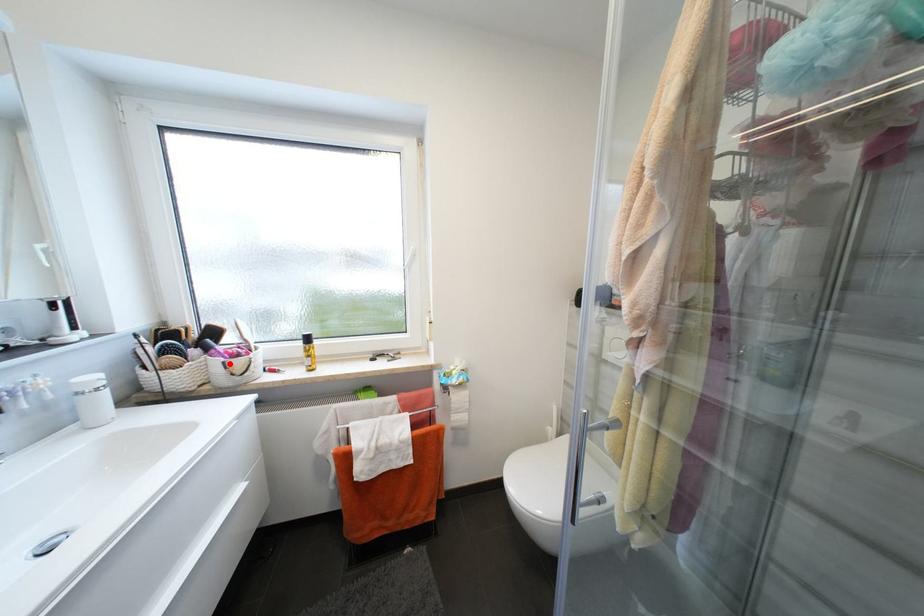
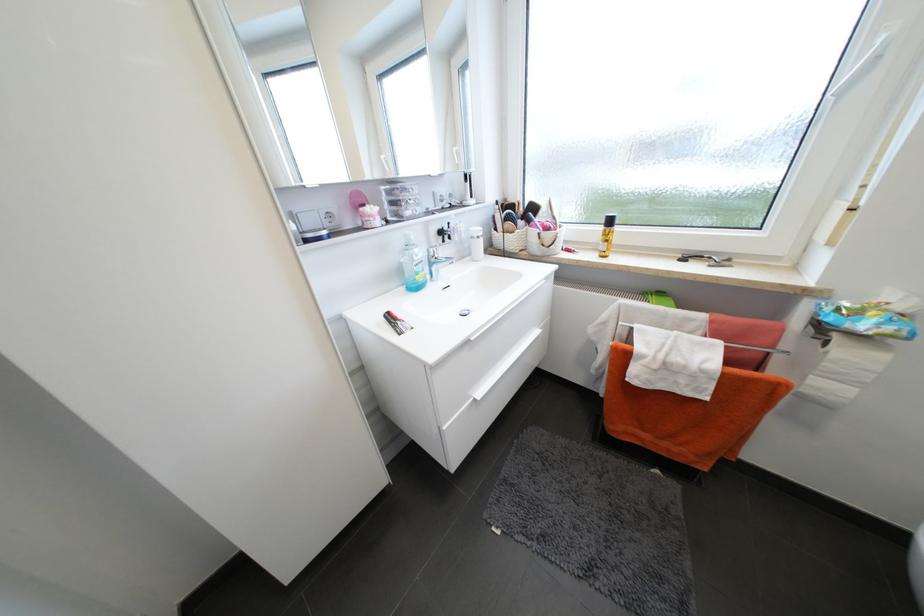
Question: I am providing you with two images of the same scene from different viewpoints. A red point is shown in image1. For the corresponding object point in image2, is it positioned nearer or farther from the camera?

Choices:
 (A) Nearer
 (B) Farther

Answer: (A)